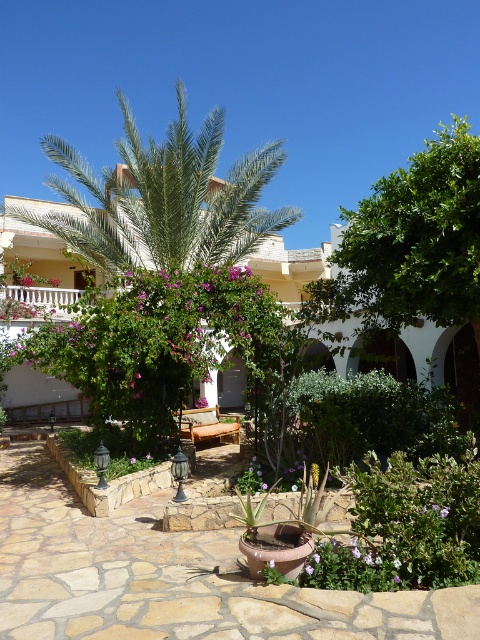
Question: Is white stucco villa at center above pink matte flower at upper center?

Choices:
 (A) no
 (B) yes

Answer: (A)

Question: Which of the following is the farthest from the observer?

Choices:
 (A) (254, 260)
 (B) (57, 284)
 (C) (128, 188)

Answer: (A)

Question: Estimate the real-world distances between objects in this image. Which object is farther from the green leafy palm tree at center?

Choices:
 (A) terracotta pot at center
 (B) purple matte flower at center
 (C) pink matte flower at upper center
 (D) green leafy tree at upper right

Answer: (A)

Question: Is green leafy tree at upper right below purple matte flower at center?

Choices:
 (A) no
 (B) yes

Answer: (A)

Question: Observing the image, what is the correct spatial positioning of green leafy palm tree at center in reference to green leafy tree at upper right?

Choices:
 (A) above
 (B) below

Answer: (B)

Question: Which point is farther to the camera?

Choices:
 (A) terracotta pot at center
 (B) green leafy tree at upper right
 (C) green leafy palm tree at center
 (D) purple matte flower at center

Answer: (D)